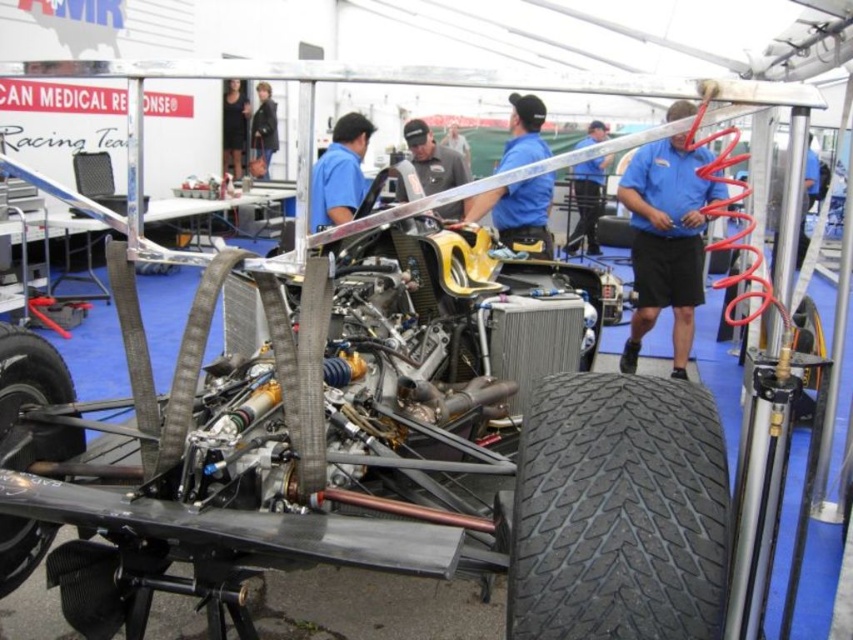
You are a photographer standing in the pit area. You want to take a photo of the blue shirt at center and the black rubber tire at lower left. Based on their sizes, which object should you focus on first if you want both to be in sharp focus?

The black rubber tire at lower left is thinner than the blue shirt at center. Since the tire is thinner, it requires less depth of field to keep in focus. However, focusing on the blue shirt at center ensures both are sharp because it is larger and closer to the optimal focus point for both subjects.

You are a photographer at the pit stop and need to capture a clear photo of both the matte black shirt at center and the black leather jacket at upper center. Since the camera can only focus on one subject at a time, which subject should you focus on to ensure the other appears in the background?

The matte black shirt at center is larger in size than the black leather jacket at upper center, so focusing on the matte black shirt at center will keep it sharp while the smaller black leather jacket at upper center may appear in the background with acceptable focus.